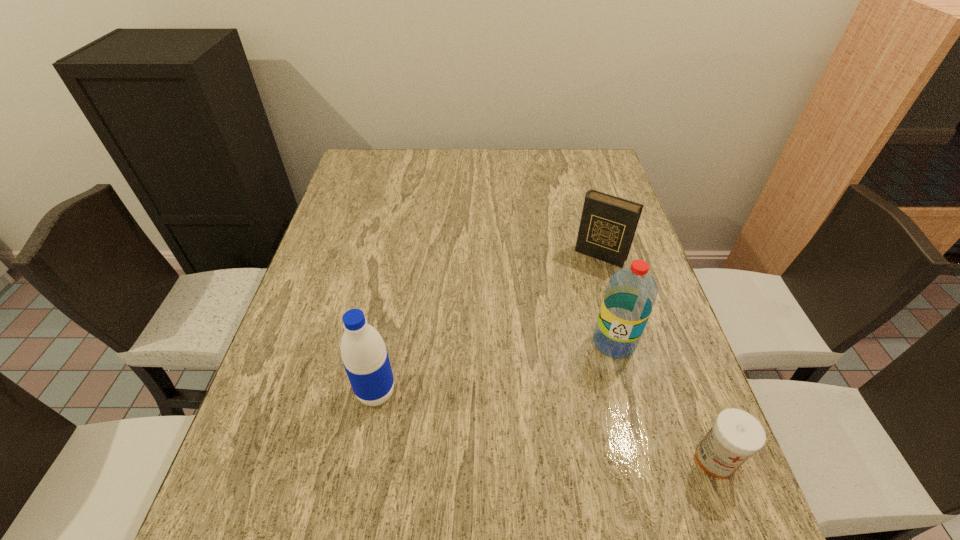
At what (x,y) coordinates should I click in order to perform the action: click on blank region between the medicine and the diary. Please return your answer as a coordinate pair (x, y). The image size is (960, 540). Looking at the image, I should click on (658, 357).

Locate an element on the screen. Image resolution: width=960 pixels, height=540 pixels. vacant space that is in between the third farthest object and the shortest object is located at coordinates (545, 426).

Find the location of a particular element. Image resolution: width=960 pixels, height=540 pixels. empty space that is in between the second farthest object and the nearer water bottle is located at coordinates (495, 367).

Find the location of `vacant space that is in between the nearest object and the leftmost object`. vacant space that is in between the nearest object and the leftmost object is located at coordinates click(x=545, y=426).

I want to click on free point between the right water bottle and the shortest object, so click(x=664, y=401).

In order to click on object that is the second closest to the nearer water bottle in this screenshot , I will do `click(608, 223)`.

This screenshot has height=540, width=960. Find the location of `object that stands as the third closest to the farthest object`. object that stands as the third closest to the farthest object is located at coordinates (365, 358).

Identify the location of vacant area that satisfies the following two spatial constraints: 1. on the back side of the farthest object; 2. on the right side of the farther water bottle. (591, 255).

At what (x,y) coordinates should I click in order to perform the action: click on free space in the image that satisfies the following two spatial constraints: 1. on the front side of the right water bottle; 2. on the left side of the nearest object. Please return your answer as a coordinate pair (x, y). Looking at the image, I should click on (645, 460).

Locate an element on the screen. vacant space that satisfies the following two spatial constraints: 1. on the front side of the farthest object; 2. on the right side of the shortest object is located at coordinates (660, 460).